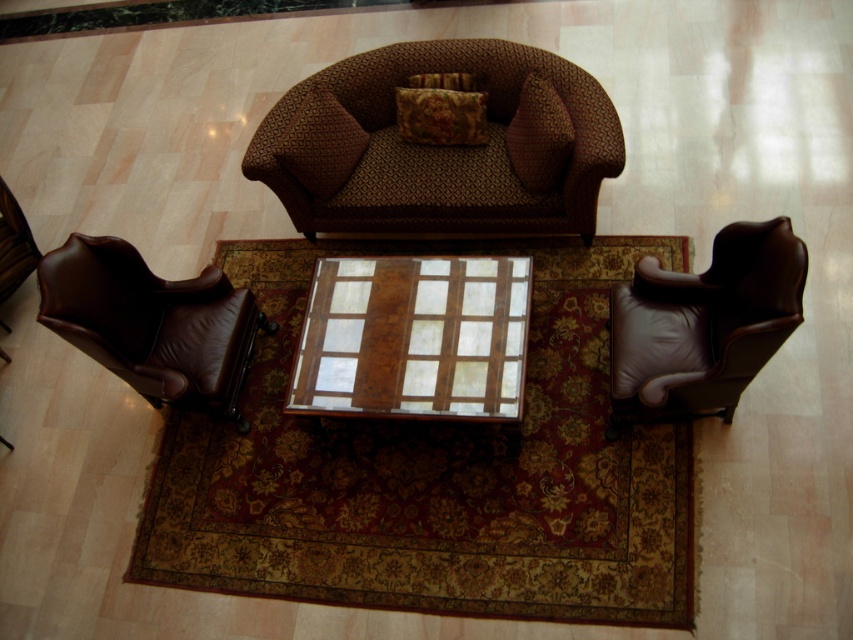
You are arranging a living room and have both the velvet cushion at center and the floral fabric pillow at center. Which one is wider?

The floral fabric pillow at center is wider than the velvet cushion at center.

You are planning to place a decorative vase that requires 15 inches of space between the velvet cushion at center and the floral fabric pillow at center. Based on the scene, can the existing space accommodate this requirement?

The distance between the velvet cushion at center and the floral fabric pillow at center is 14.61 inches, which is slightly less than the required 15 inches. Therefore, the space is insufficient to place the decorative vase as planned.

You are standing in the living room and looking down at the coffee table. There are two points marked on the floor near the coffee table. The first point is at coordinates point (651, 316) and the second point is at point (233, 356). Which of these two points is closer to your current viewpoint?

Point (651, 316) is closer to the camera than point (233, 356), so the first point is closer to your viewpoint.